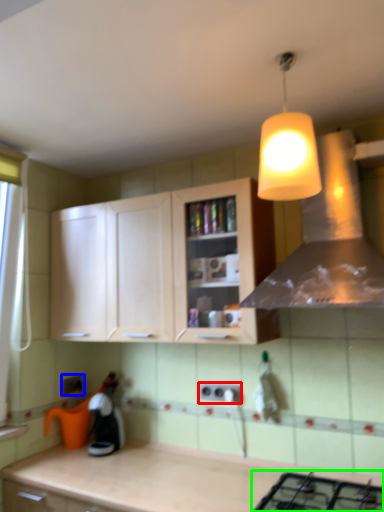
Question: Estimate the real-world distances between objects in this image. Which object is closer to electric outlet (highlighted by a red box), electric outlet (highlighted by a blue box) or gas stove (highlighted by a green box)?

Choices:
 (A) electric outlet
 (B) gas stove

Answer: (B)